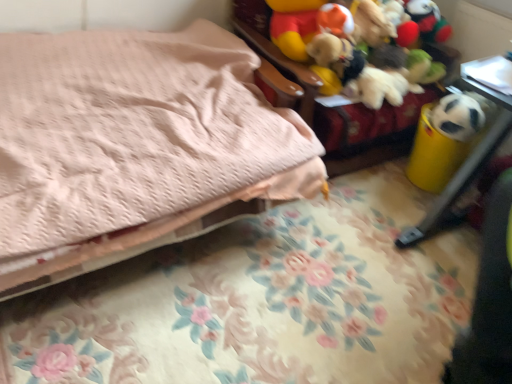
Question: Is white matte panda at right at the back of soft fabric stuffed toys at upper right, the 2th furniture in the bottom-to-top sequence?

Choices:
 (A) yes
 (B) no

Answer: (B)

Question: From the image's perspective, is soft fabric stuffed toys at upper right, the 2th furniture in the bottom-to-top sequence, on top of white matte panda at right?

Choices:
 (A) yes
 (B) no

Answer: (A)

Question: Is soft fabric stuffed toys at upper right, the 2th furniture in the bottom-to-top sequence, positioned far away from white matte panda at right?

Choices:
 (A) no
 (B) yes

Answer: (A)

Question: From a real-world perspective, is soft fabric stuffed toys at upper right, which ranks as the 1th furniture in top-to-bottom order, located higher than white matte panda at right?

Choices:
 (A) yes
 (B) no

Answer: (B)

Question: From the image's perspective, is soft fabric stuffed toys at upper right, the 2th furniture in the bottom-to-top sequence, under white matte panda at right?

Choices:
 (A) yes
 (B) no

Answer: (B)

Question: From a real-world perspective, is white matte panda at right above or below pink quilted bed at upper left?

Choices:
 (A) above
 (B) below

Answer: (A)

Question: Visually, is white matte panda at right positioned to the left or to the right of pink quilted bed at upper left?

Choices:
 (A) left
 (B) right

Answer: (B)

Question: Choose the correct answer: Is white matte panda at right inside pink quilted bed at upper left or outside it?

Choices:
 (A) outside
 (B) inside

Answer: (A)

Question: Considering the positions of point (451, 122) and point (96, 216), is point (451, 122) closer or farther from the camera than point (96, 216)?

Choices:
 (A) closer
 (B) farther

Answer: (B)

Question: Considering the positions of pink quilted bed at upper left and soft fabric stuffed toys at upper right, which ranks as the 1th furniture in top-to-bottom order, in the image, is pink quilted bed at upper left bigger or smaller than soft fabric stuffed toys at upper right, which ranks as the 1th furniture in top-to-bottom order,?

Choices:
 (A) big
 (B) small

Answer: (A)

Question: Considering the positions of pink quilted bed at upper left and soft fabric stuffed toys at upper right, which ranks as the 1th furniture in top-to-bottom order, in the image, is pink quilted bed at upper left wider or thinner than soft fabric stuffed toys at upper right, which ranks as the 1th furniture in top-to-bottom order,?

Choices:
 (A) wide
 (B) thin

Answer: (A)

Question: Is pink quilted bed at upper left in front of or behind soft fabric stuffed toys at upper right, the 2th furniture in the bottom-to-top sequence, in the image?

Choices:
 (A) behind
 (B) front

Answer: (B)

Question: Is pink quilted bed at upper left to the left or to the right of soft fabric stuffed toys at upper right, which ranks as the 1th furniture in top-to-bottom order, in the image?

Choices:
 (A) right
 (B) left

Answer: (B)

Question: In the image, is pink quilted bed at upper left positioned in front of or behind yellow plastic trash can at right, the 1th furniture from the bottom?

Choices:
 (A) behind
 (B) front

Answer: (B)

Question: Considering the positions of pink quilted bed at upper left and yellow plastic trash can at right, the 1th furniture from the bottom, in the image, is pink quilted bed at upper left taller or shorter than yellow plastic trash can at right, the 1th furniture from the bottom,?

Choices:
 (A) tall
 (B) short

Answer: (B)